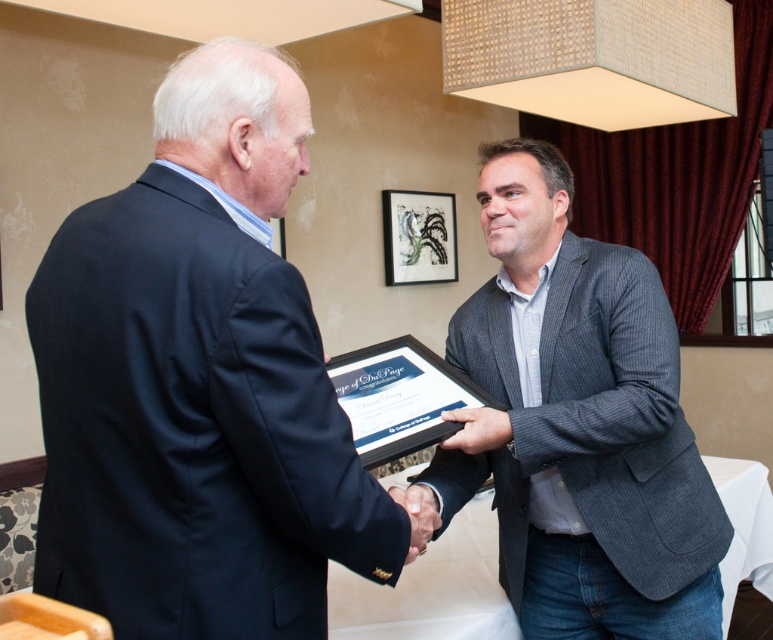
Question: Does dark blue suit at center appear on the right side of gray corduroy blazer at center?

Choices:
 (A) yes
 (B) no

Answer: (B)

Question: Which object appears closest to the camera in this image?

Choices:
 (A) dark blue suit at center
 (B) gray corduroy blazer at center

Answer: (A)

Question: Does matte black hand at center lie in front of smooth black hand at center?

Choices:
 (A) no
 (B) yes

Answer: (A)

Question: Does dark blue suit at center have a smaller size compared to gray corduroy blazer at center?

Choices:
 (A) no
 (B) yes

Answer: (B)

Question: Considering the real-world distances, which object is closest to the gray corduroy blazer at center?

Choices:
 (A) matte black hand at center
 (B) dark blue suit at center

Answer: (A)

Question: Which object appears farthest from the camera in this image?

Choices:
 (A) smooth black hand at center
 (B) matte black hand at center
 (C) dark blue suit at center
 (D) gray corduroy blazer at center

Answer: (B)